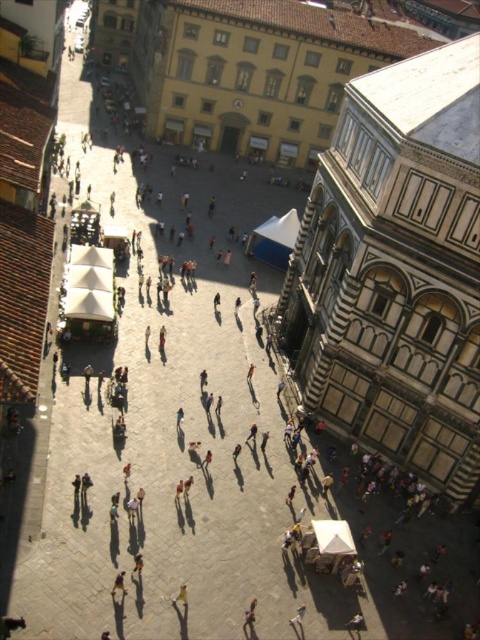
Based on the photo, you are a photographer standing in the square and want to take a photo of both the light brown leather jacket at lower center and the light brown leather jacket at lower left. Since you can only focus on one jacket at a time, which jacket should you adjust your camera to focus on first if you want to capture them in the order they appear from left to right?

You should focus on the light brown leather jacket at lower left first because it is positioned to the left of the light brown leather jacket at lower center.

Looking at this image, you are standing in the square and want to take a photo of both the point at (300, 624) and the point at (186, 589). Which point should you focus on first to ensure both are in focus?

You should focus on the point at (186, 589) first because it is closer to you than the point at (300, 624), which is further away. By focusing on the closer point, the further point will also be within the depth of field.

You are standing in the square and see the light brown leather jacket at lower left and the light brown wooden chair at center. Which object is positioned higher in the image?

The light brown leather jacket at lower left is located above the light brown wooden chair at center, so it is positioned higher in the image.